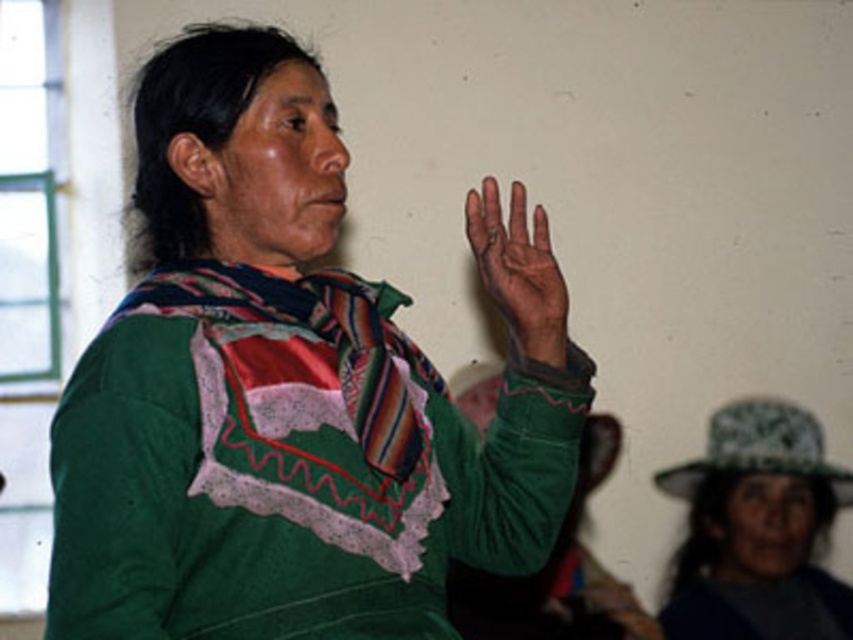
You are standing in the room and want to place a small decoration between the two points, point (253, 544) and point (693, 579). Which point should the decoration be closer to in order to be positioned in front of the other point?

The decoration should be closer to point (253, 544) because it is in front of point (693, 579).